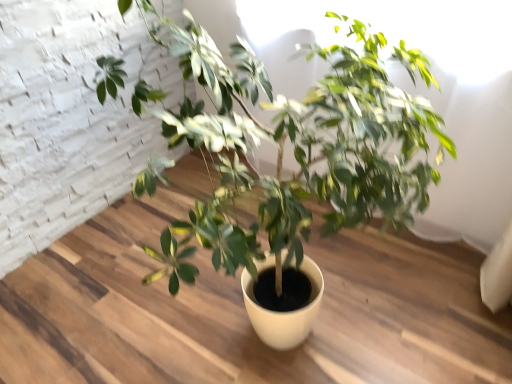
The height and width of the screenshot is (384, 512). Find the location of `vacant space underneath green matte plant at center (from a real-world perspective)`. vacant space underneath green matte plant at center (from a real-world perspective) is located at coordinates (244, 322).